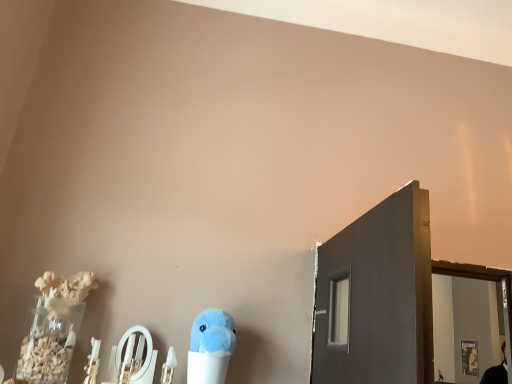
Question: Does metallic silver mirror at lower center contain fluffy blue plush at center?

Choices:
 (A) no
 (B) yes

Answer: (A)

Question: Is the position of metallic silver mirror at lower center less distant than that of fluffy blue plush at center?

Choices:
 (A) yes
 (B) no

Answer: (B)

Question: Does metallic silver mirror at lower center come behind fluffy blue plush at center?

Choices:
 (A) no
 (B) yes

Answer: (B)

Question: Considering the relative sizes of metallic silver mirror at lower center and fluffy blue plush at center in the image provided, is metallic silver mirror at lower center thinner than fluffy blue plush at center?

Choices:
 (A) yes
 (B) no

Answer: (A)

Question: Is metallic silver mirror at lower center turned away from fluffy blue plush at center?

Choices:
 (A) no
 (B) yes

Answer: (A)

Question: Is metallic silver mirror at lower center shorter than fluffy blue plush at center?

Choices:
 (A) yes
 (B) no

Answer: (A)

Question: Is fluffy blue plush at center completely or partially outside of metallic silver mirror at lower center?

Choices:
 (A) yes
 (B) no

Answer: (A)

Question: Is fluffy blue plush at center positioned behind metallic silver mirror at lower center?

Choices:
 (A) no
 (B) yes

Answer: (A)

Question: Considering the relative sizes of fluffy blue plush at center and metallic silver mirror at lower center in the image provided, is fluffy blue plush at center smaller than metallic silver mirror at lower center?

Choices:
 (A) no
 (B) yes

Answer: (A)

Question: Is fluffy blue plush at center thinner than metallic silver mirror at lower center?

Choices:
 (A) yes
 (B) no

Answer: (B)

Question: Does fluffy blue plush at center turn towards metallic silver mirror at lower center?

Choices:
 (A) yes
 (B) no

Answer: (B)

Question: Is fluffy blue plush at center positioned in front of metallic silver mirror at lower center?

Choices:
 (A) yes
 (B) no

Answer: (A)

Question: Is fluffy blue plush at center in front of or behind metallic silver mirror at lower center in the image?

Choices:
 (A) behind
 (B) front

Answer: (B)